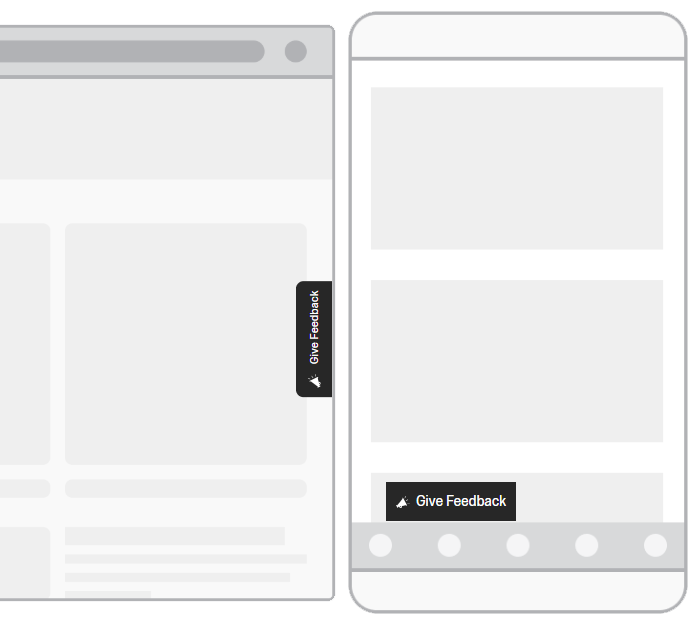
Locate an element on the screen. The width and height of the screenshot is (700, 626). gray divider bar is located at coordinates (127, 54).